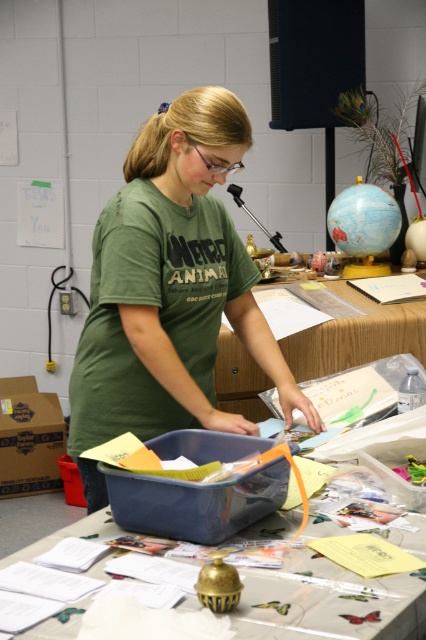
Question: Does translucent plastic table at center appear on the right side of wooden table at center?

Choices:
 (A) yes
 (B) no

Answer: (B)

Question: Which of the following is the closest to the observer?

Choices:
 (A) green matte shirt at center
 (B) translucent plastic table at center

Answer: (B)

Question: In this image, where is green matte shirt at center located relative to translucent plastic table at center?

Choices:
 (A) above
 (B) below

Answer: (A)

Question: From the image, what is the correct spatial relationship of translucent plastic table at center in relation to wooden table at center?

Choices:
 (A) below
 (B) above

Answer: (A)

Question: Which of the following is the closest to the observer?

Choices:
 (A) (230, 349)
 (B) (396, 611)

Answer: (B)

Question: Which point appears closest to the camera in this image?

Choices:
 (A) (195, 184)
 (B) (271, 577)

Answer: (B)